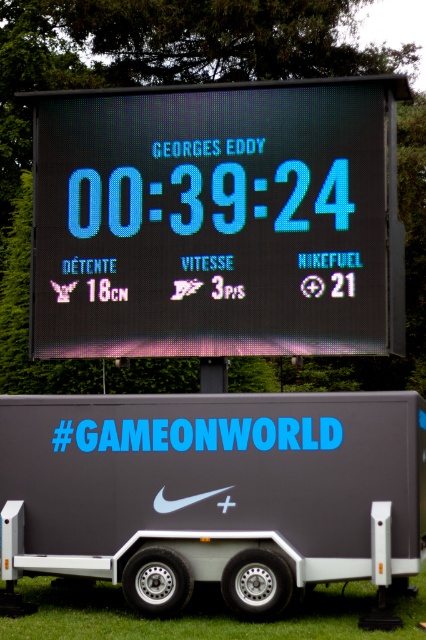
What object is located at the coordinates point (218, 220)?

The black led scoreboard at center is located at point (218, 220).

You are standing at the origin point of a coordinate system. The black led scoreboard at center is located at point 0.345, 0.512. If you want to walk directly to it, in which direction should you move?

You should move towards the point [218,220] to reach the black led scoreboard at center.

In the scene shown: You are a technician standing in front of the matte gray trailer at center and need to adjust the black led scoreboard at center. Can you reach the scoreboard without moving the trailer?

The black led scoreboard at center is further to the viewer than the matte gray trailer at center, so you can reach it without moving the trailer since it is positioned closer to you.